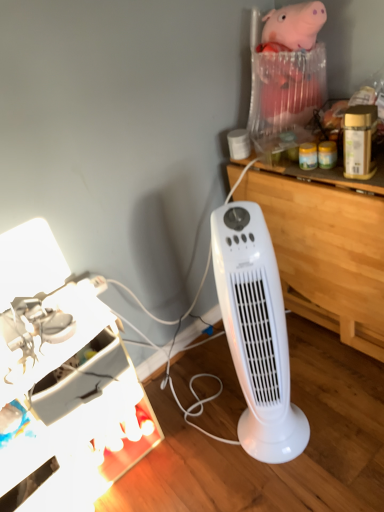
Locate an element on the screen. This screenshot has height=512, width=384. vacant space positioned to the left of white plastic tower fan at center is located at coordinates (211, 445).